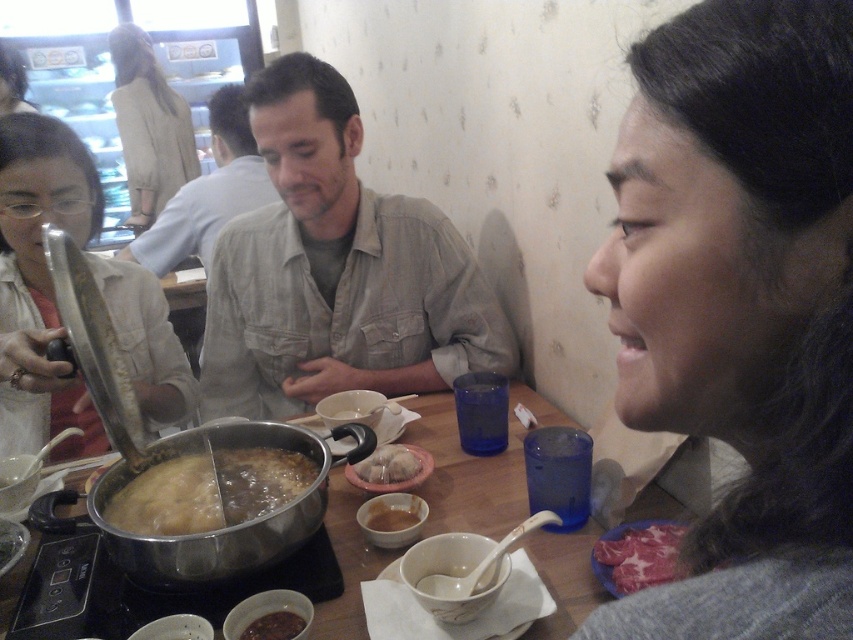
Which is behind, point (741, 408) or point (395, 225)?

The point (395, 225) is more distant.

The image size is (853, 640). Identify the location of smooth gray hair at right. (741, 307).

Is point (764, 604) positioned behind point (498, 316)?

No, it is in front of (498, 316).

At what (x,y) coordinates should I click in order to perform the action: click on smooth gray hair at right. Please return your answer as a coordinate pair (x, y). This screenshot has height=640, width=853. Looking at the image, I should click on (741, 307).

Which is more to the right, raw pink meat at lower right or white glossy meatballs at center?

raw pink meat at lower right is more to the right.

Is the position of raw pink meat at lower right more distant than that of white glossy meatballs at center?

No, raw pink meat at lower right is in front of white glossy meatballs at center.

Is point (625, 541) closer to camera compared to point (369, 483)?

That is True.

This screenshot has width=853, height=640. I want to click on raw pink meat at lower right, so pyautogui.click(x=636, y=556).

Does khaki cotton shirt at center appear on the left side of raw pink meat at lower right?

Yes, khaki cotton shirt at center is to the left of raw pink meat at lower right.

Does point (312, 228) come farther from viewer compared to point (643, 582)?

Yes, point (312, 228) is farther from viewer.

Where is `khaki cotton shirt at center`? khaki cotton shirt at center is located at coordinates (335, 269).